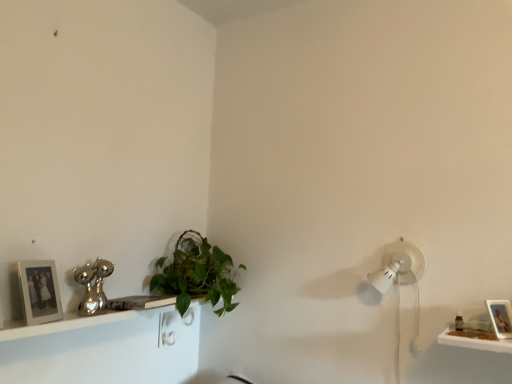
Question: Can you confirm if wooden photo frame at lower right, the second picture frame in the left-to-right sequence, is smaller than white glossy shelf at lower left?

Choices:
 (A) no
 (B) yes

Answer: (B)

Question: From the image's perspective, is wooden photo frame at lower right, the second picture frame in the left-to-right sequence, on white glossy shelf at lower left?

Choices:
 (A) no
 (B) yes

Answer: (B)

Question: Considering the relative positions of wooden photo frame at lower right, which is counted as the 1th picture frame, starting from the right, and white glossy shelf at lower left in the image provided, is wooden photo frame at lower right, which is counted as the 1th picture frame, starting from the right, behind white glossy shelf at lower left?

Choices:
 (A) no
 (B) yes

Answer: (B)

Question: From a real-world perspective, is wooden photo frame at lower right, the second picture frame in the left-to-right sequence, below white glossy shelf at lower left?

Choices:
 (A) yes
 (B) no

Answer: (B)

Question: Does wooden photo frame at lower right, the second picture frame in the left-to-right sequence, appear on the left side of white glossy shelf at lower left?

Choices:
 (A) no
 (B) yes

Answer: (A)

Question: Can you confirm if wooden photo frame at lower right, which is counted as the 1th picture frame, starting from the right, is shorter than white glossy shelf at lower left?

Choices:
 (A) yes
 (B) no

Answer: (A)

Question: From a real-world perspective, is green leafy plant at center located higher than white glossy shelf at lower left?

Choices:
 (A) no
 (B) yes

Answer: (B)

Question: Is green leafy plant at center positioned in front of white glossy shelf at lower left?

Choices:
 (A) no
 (B) yes

Answer: (A)

Question: Does green leafy plant at center contain white glossy shelf at lower left?

Choices:
 (A) yes
 (B) no

Answer: (B)

Question: Is green leafy plant at center to the right of white glossy shelf at lower left from the viewer's perspective?

Choices:
 (A) no
 (B) yes

Answer: (B)

Question: Is green leafy plant at center looking in the opposite direction of white glossy shelf at lower left?

Choices:
 (A) yes
 (B) no

Answer: (B)

Question: Is the position of green leafy plant at center more distant than that of white glossy shelf at lower left?

Choices:
 (A) yes
 (B) no

Answer: (A)

Question: Does green leafy plant at center have a larger size compared to wooden photo frame at lower right, the second picture frame in the left-to-right sequence?

Choices:
 (A) yes
 (B) no

Answer: (A)